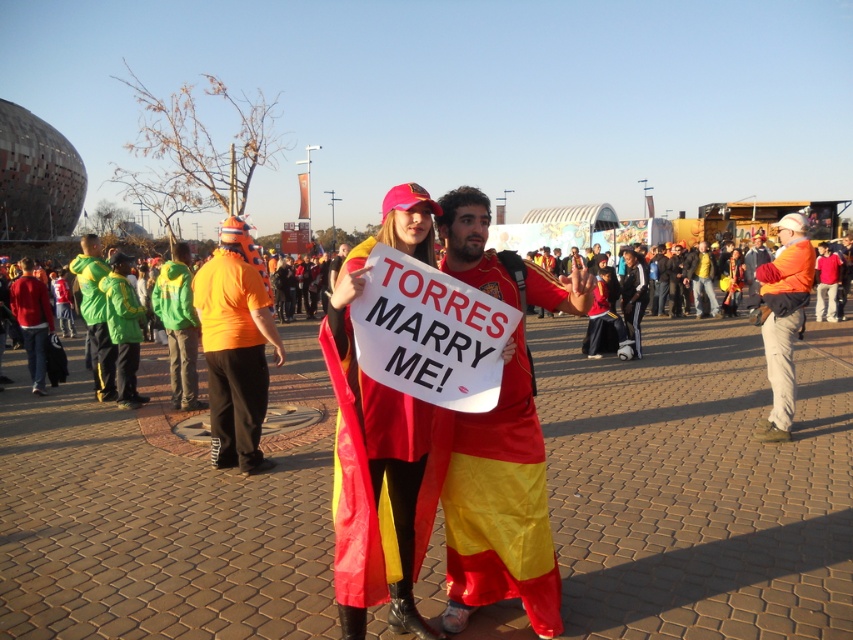
Question: Based on their relative distances, which object is nearer to the green fabric jacket at left?

Choices:
 (A) red/yellow fabric draped at center
 (B) orange fabric shirt at center
 (C) green fleece jacket at left
 (D) red/yellow fabric cape at center

Answer: (C)

Question: Which of the following is the farthest from the observer?

Choices:
 (A) (792, 380)
 (B) (190, 339)
 (C) (328, 316)
 (D) (96, 285)

Answer: (D)

Question: Is orange fabric jacket at center thinner than green fabric jacket at left?

Choices:
 (A) no
 (B) yes

Answer: (B)

Question: Is red/yellow fabric cape at center wider than green fleece jacket at left?

Choices:
 (A) yes
 (B) no

Answer: (A)

Question: Which point is closer to the camera?

Choices:
 (A) orange fabric shirt at center
 (B) matte red sweater at left

Answer: (A)

Question: Is red/yellow fabric cape at center above matte red sweater at left?

Choices:
 (A) yes
 (B) no

Answer: (B)